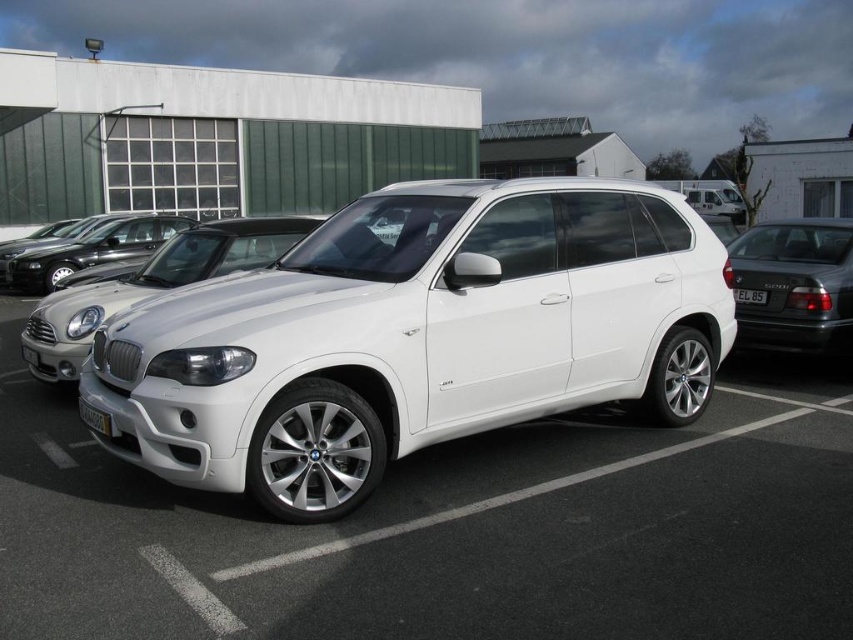
Question: Which object is closer to the camera taking this photo?

Choices:
 (A) white metallic suv at center
 (B) white plastic license plate at center
 (C) white metallic car at center

Answer: (C)

Question: Which point is closer to the camera?

Choices:
 (A) (616, 349)
 (B) (241, 228)
 (C) (793, 316)
 (D) (165, 236)

Answer: (A)

Question: Does glossy black car at right appear under satin black car at center?

Choices:
 (A) yes
 (B) no

Answer: (A)

Question: Considering the relative positions of glossy black car at right and white plastic license plate at center in the image provided, where is glossy black car at right located with respect to white plastic license plate at center?

Choices:
 (A) right
 (B) left

Answer: (A)

Question: Which object is closer to the camera taking this photo?

Choices:
 (A) white plastic license plate at center
 (B) glossy black car at right
 (C) white glossy suv at center

Answer: (C)

Question: Is white metallic car at center further to camera compared to yellow plastic license plate at lower center?

Choices:
 (A) no
 (B) yes

Answer: (A)